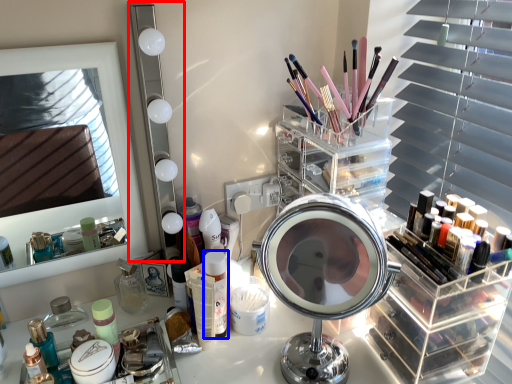
Question: Among these objects, which one is farthest to the camera, mirror (highlighted by a red box) or toiletry (highlighted by a blue box)?

Choices:
 (A) mirror
 (B) toiletry

Answer: (B)